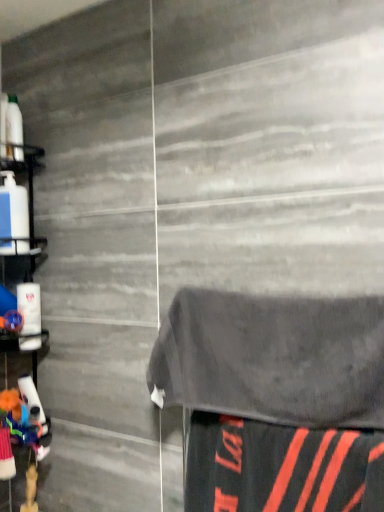
Measure the distance between white plastic shelf at left and camera.

white plastic shelf at left and camera are 1.20 meters apart.

Where is `dark gray towel at center`? Image resolution: width=384 pixels, height=512 pixels. dark gray towel at center is located at coordinates (273, 358).

Locate an element on the screen. white plastic shelf at left is located at coordinates (29, 204).

Which is in front, dark gray towel at center or black matte fabric at lower right?

black matte fabric at lower right is in front.

The image size is (384, 512). Find the location of `bath towel above the black matte fabric at lower right (from the image's perspective)`. bath towel above the black matte fabric at lower right (from the image's perspective) is located at coordinates (273, 358).

Which of these two, dark gray towel at center or black matte fabric at lower right, is smaller?

black matte fabric at lower right.

Can you tell me how much white plastic shelf at left and dark gray towel at center differ in facing direction?

They differ by 90 degrees in their facing directions.

Based on their positions, is white plastic shelf at left located to the left or right of dark gray towel at center?

In the image, white plastic shelf at left appears on the left side of dark gray towel at center.

Is white plastic shelf at left far away from dark gray towel at center?

Actually, white plastic shelf at left and dark gray towel at center are a little close together.

Is point (4, 274) in front of point (260, 415)?

No, it is behind (260, 415).

Based on their sizes in the image, would you say white plastic shelf at left is bigger or smaller than black matte fabric at lower right?

Considering their sizes, white plastic shelf at left takes up more space than black matte fabric at lower right.

Between point (31, 269) and point (316, 453), which one is positioned in front?

The point (316, 453) is closer to the camera.

Would you say white plastic shelf at left is inside or outside black matte fabric at lower right?

The correct answer is: outside.

This screenshot has width=384, height=512. In order to click on fabric that appears in front of the white plastic shelf at left in this screenshot , I will do `click(281, 467)`.

Is black matte fabric at lower right positioned beyond the bounds of white plastic shelf at left?

Yes, black matte fabric at lower right is outside of white plastic shelf at left.

Does black matte fabric at lower right appear on the right side of white plastic shelf at left?

Yes, black matte fabric at lower right is to the right of white plastic shelf at left.

Consider the image. Is dark gray towel at center in front of or behind white plastic shelf at left in the image?

dark gray towel at center is in front of white plastic shelf at left.

Could you tell me if dark gray towel at center is facing white plastic shelf at left?

No, dark gray towel at center is not oriented towards white plastic shelf at left.

Find the location of a particular element. bath towel below the white plastic shelf at left (from a real-world perspective) is located at coordinates (273, 358).

From a real-world perspective, is dark gray towel at center physically located above or below white plastic shelf at left?

Clearly, from a real-world perspective, dark gray towel at center is below white plastic shelf at left.

Is black matte fabric at lower right smaller than dark gray towel at center?

Yes.

In the scene shown: Which object is thinner, black matte fabric at lower right or dark gray towel at center?

With smaller width is black matte fabric at lower right.

Is black matte fabric at lower right located outside dark gray towel at center?

That's correct, black matte fabric at lower right is outside of dark gray towel at center.

From the image's perspective, between black matte fabric at lower right and dark gray towel at center, which one is located above?

From the image's view, dark gray towel at center is above.

The height and width of the screenshot is (512, 384). Find the location of `bath towel behind the black matte fabric at lower right`. bath towel behind the black matte fabric at lower right is located at coordinates (273, 358).

Image resolution: width=384 pixels, height=512 pixels. I want to click on bath towel in front of the white plastic shelf at left, so click(x=273, y=358).

Looking at the image, which one is located further to white plastic shelf at left, black matte fabric at lower right or dark gray towel at center?

black matte fabric at lower right.

Considering their positions, is dark gray towel at center positioned further to white plastic shelf at left than black matte fabric at lower right?

Among the two, black matte fabric at lower right is located further to white plastic shelf at left.

Considering their positions, is black matte fabric at lower right positioned closer to dark gray towel at center than white plastic shelf at left?

The object closer to dark gray towel at center is black matte fabric at lower right.

Based on their spatial positions, is white plastic shelf at left or black matte fabric at lower right closer to dark gray towel at center?

black matte fabric at lower right.

Looking at the image, which one is located further to black matte fabric at lower right, white plastic shelf at left or dark gray towel at center?

white plastic shelf at left is positioned further to the anchor black matte fabric at lower right.

Based on the photo, when comparing their distances from black matte fabric at lower right, does dark gray towel at center or white plastic shelf at left seem further?

white plastic shelf at left is positioned further to the anchor black matte fabric at lower right.

Identify the location of bath towel between white plastic shelf at left and black matte fabric at lower right from left to right. (273, 358).